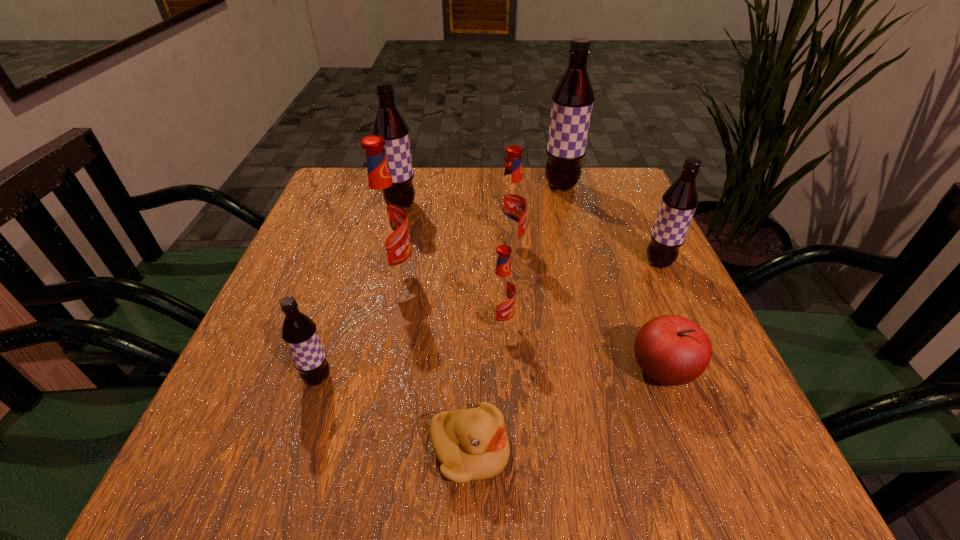
I want to click on vacant space at the far edge of the desktop, so click(x=467, y=207).

Locate an element on the screen. This screenshot has height=540, width=960. vacant space at the left edge is located at coordinates click(x=325, y=299).

You are a GUI agent. You are given a task and a screenshot of the screen. Output one action in this format:
    pyautogui.click(x=<x>, y=<y>)
    Task: Click on the free space at the right edge of the desktop
    The width and height of the screenshot is (960, 540).
    Given the screenshot: What is the action you would take?
    pyautogui.click(x=668, y=440)

Where is `free space at the near left corner`? The height and width of the screenshot is (540, 960). free space at the near left corner is located at coordinates (209, 490).

Locate an element on the screen. The image size is (960, 540). free space at the far right corner of the desktop is located at coordinates (631, 187).

This screenshot has height=540, width=960. I want to click on vacant region between the second nearest brown root beer and the duckling, so click(564, 357).

Where is `free space between the sixth nearest root beer and the tallest object`? Image resolution: width=960 pixels, height=540 pixels. free space between the sixth nearest root beer and the tallest object is located at coordinates (481, 195).

You are a GUI agent. You are given a task and a screenshot of the screen. Output one action in this format:
    pyautogui.click(x=<x>, y=<y>)
    Task: Click on the vacant area that lies between the red apple and the shortest object
    This screenshot has width=960, height=540.
    Given the screenshot: What is the action you would take?
    pyautogui.click(x=566, y=411)

You are a GUI agent. You are given a task and a screenshot of the screen. Output one action in this format:
    pyautogui.click(x=<x>, y=<y>)
    Task: Click on the free space between the red apple and the second biggest red root beer
    The image size is (960, 540).
    Given the screenshot: What is the action you would take?
    pyautogui.click(x=586, y=309)

Locate an element on the screen. Image resolution: width=960 pixels, height=540 pixels. free space between the fourth nearest object and the duckling is located at coordinates (485, 388).